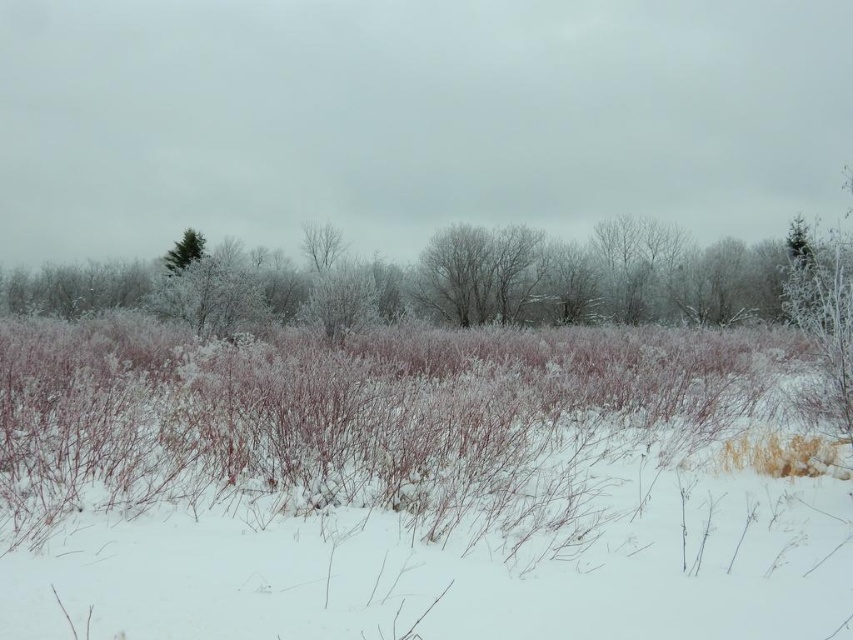
Is the position of frosty bark tree at center more distant than that of green matte tree at upper left?

Yes.

Does frosty bark tree at center have a greater width compared to green matte tree at upper left?

No, frosty bark tree at center is not wider than green matte tree at upper left.

This screenshot has height=640, width=853. Identify the location of frosty bark tree at center. (321, 244).

Does frosty branches at center have a lesser height compared to green matte tree at upper left?

In fact, frosty branches at center may be taller than green matte tree at upper left.

Measure the distance between frosty branches at center and camera.

frosty branches at center is 52.34 meters away from camera.

Describe the element at coordinates (480, 273) in the screenshot. This screenshot has width=853, height=640. I see `frosty branches at center` at that location.

Find the location of a particular element. Image resolution: width=853 pixels, height=640 pixels. frosty branches at center is located at coordinates (480, 273).

Does frosty branches at center appear on the left side of frosty bark tree at center?

In fact, frosty branches at center is to the right of frosty bark tree at center.

Is frosty branches at center bigger than frosty bark tree at center?

Yes, frosty branches at center is bigger than frosty bark tree at center.

The width and height of the screenshot is (853, 640). Find the location of `frosty branches at center`. frosty branches at center is located at coordinates (480, 273).